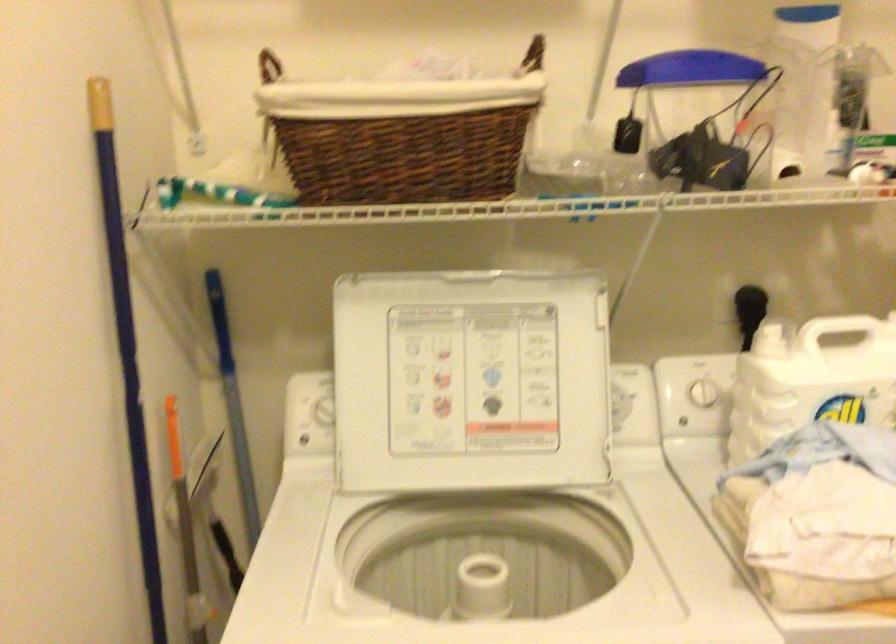
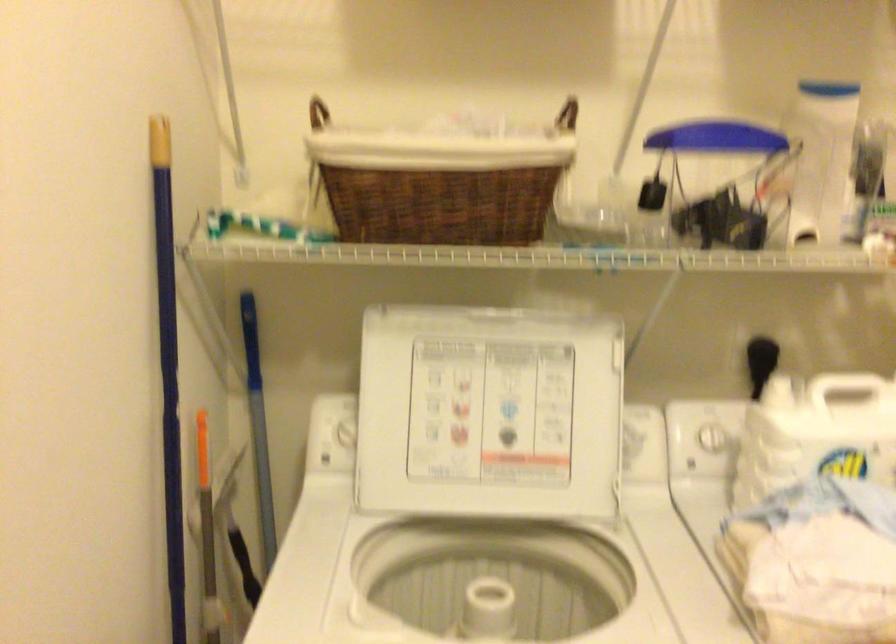
Find the pixel in the second image that matches (799,93) in the first image.

(821, 158)